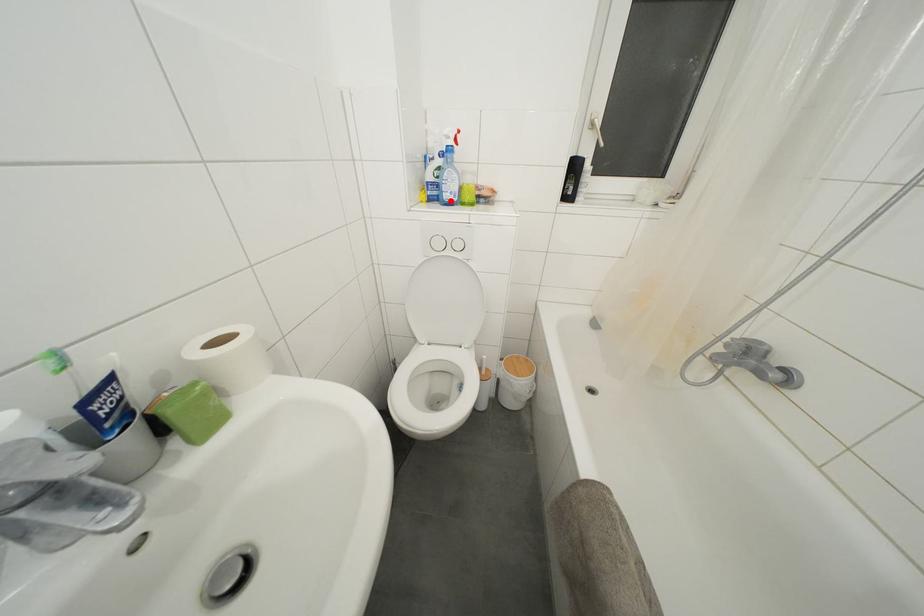
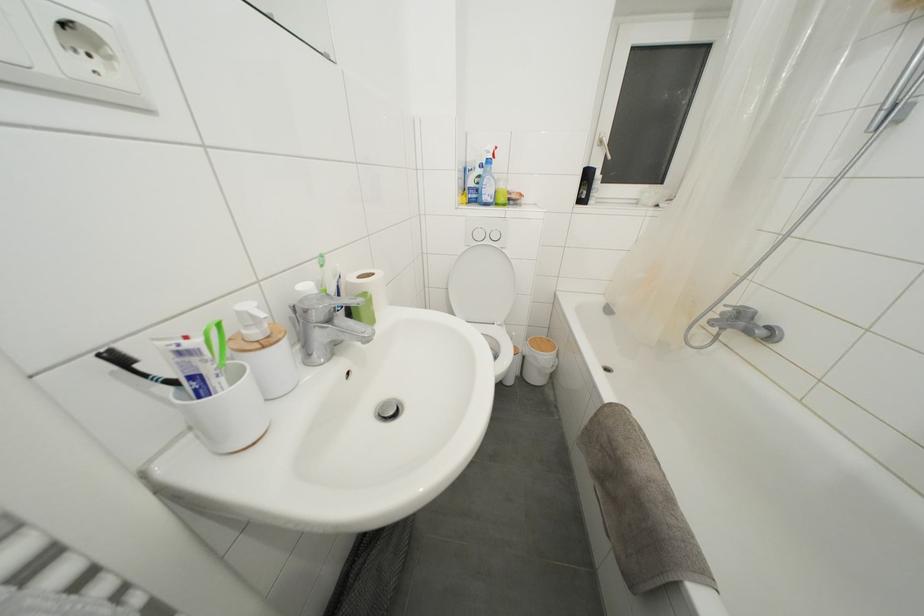
Question: I am providing you with two images of the same scene from different viewpoints. Given a red point in image1, look at the same physical point in image2. Is it:

Choices:
 (A) Closer to the viewpoint
 (B) Farther from the viewpoint

Answer: (A)